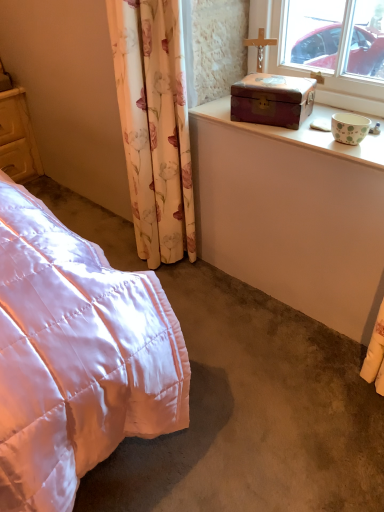
I want to click on free space on the front side of wooden box at upper right, so click(x=290, y=134).